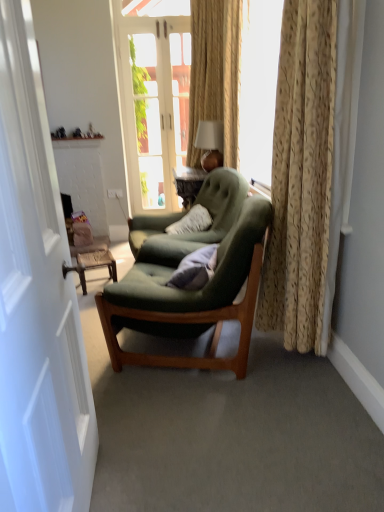
Question: Does velvet blue pillow at center come in front of matte white table lamp at upper center?

Choices:
 (A) no
 (B) yes

Answer: (B)

Question: Is velvet blue pillow at center facing towards matte white table lamp at upper center?

Choices:
 (A) no
 (B) yes

Answer: (A)

Question: Can you confirm if velvet blue pillow at center is bigger than matte white table lamp at upper center?

Choices:
 (A) no
 (B) yes

Answer: (A)

Question: Is velvet blue pillow at center turned away from matte white table lamp at upper center?

Choices:
 (A) yes
 (B) no

Answer: (B)

Question: Considering the relative sizes of velvet blue pillow at center and matte white table lamp at upper center in the image provided, is velvet blue pillow at center shorter than matte white table lamp at upper center?

Choices:
 (A) yes
 (B) no

Answer: (A)

Question: From a real-world perspective, is gold textured curtain at right above or below matte wood side table at lower left?

Choices:
 (A) below
 (B) above

Answer: (B)

Question: Relative to matte wood side table at lower left, is gold textured curtain at right in front or behind?

Choices:
 (A) behind
 (B) front

Answer: (B)

Question: Do you think gold textured curtain at right is within matte wood side table at lower left, or outside of it?

Choices:
 (A) outside
 (B) inside

Answer: (A)

Question: Considering the positions of point (281, 26) and point (99, 262), is point (281, 26) closer or farther from the camera than point (99, 262)?

Choices:
 (A) farther
 (B) closer

Answer: (B)

Question: From the image's perspective, relative to matte white table lamp at upper center, is white glass door at center, the first door viewed from the top, above or below?

Choices:
 (A) above
 (B) below

Answer: (A)

Question: Choose the correct answer: Is white glass door at center, which is the second door in front-to-back order, inside matte white table lamp at upper center or outside it?

Choices:
 (A) inside
 (B) outside

Answer: (B)

Question: From a real-world perspective, is white glass door at center, acting as the 2th door starting from the bottom, positioned above or below matte white table lamp at upper center?

Choices:
 (A) above
 (B) below

Answer: (A)

Question: In terms of height, does white glass door at center, which is the second door in front-to-back order, look taller or shorter compared to matte white table lamp at upper center?

Choices:
 (A) tall
 (B) short

Answer: (A)

Question: Visually, is white painted wood door at center, which is the second door from back to front, positioned to the left or to the right of velvet blue pillow at center?

Choices:
 (A) right
 (B) left

Answer: (B)

Question: From a real-world perspective, relative to velvet blue pillow at center, is white painted wood door at center, which is the second door from back to front, vertically above or below?

Choices:
 (A) above
 (B) below

Answer: (A)